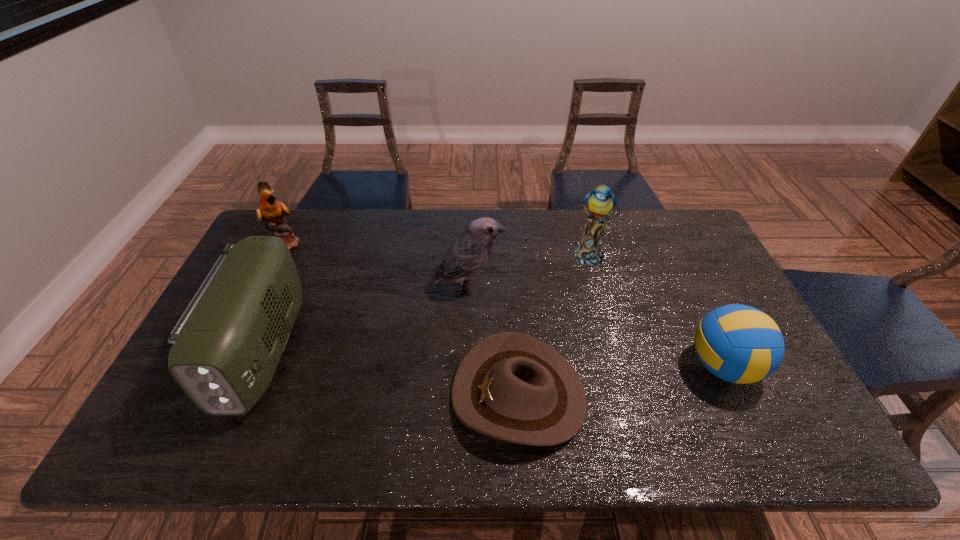
Where is `object at the far left corner`? object at the far left corner is located at coordinates (271, 211).

What are the coordinates of `object located at the near left corner` in the screenshot? It's located at (226, 347).

I want to click on vacant space at the far edge, so click(x=569, y=252).

Find the location of a particular element. The height and width of the screenshot is (540, 960). vacant space at the near edge is located at coordinates [x=482, y=456].

In the image, there is a desktop. Where is `vacant space at the near left corner`? Image resolution: width=960 pixels, height=540 pixels. vacant space at the near left corner is located at coordinates (158, 428).

Identify the location of vacant space at the far right corner of the desktop. (683, 222).

The width and height of the screenshot is (960, 540). I want to click on vacant space at the near right corner of the desktop, so click(745, 436).

The image size is (960, 540). I want to click on vacant space that's between the second object from right to left and the shortest object, so 554,325.

Locate an element on the screen. This screenshot has height=540, width=960. unoccupied position between the nearest parrot and the leftmost parrot is located at coordinates (377, 265).

Locate an element on the screen. The image size is (960, 540). empty space between the leftmost parrot and the rightmost object is located at coordinates pos(505,305).